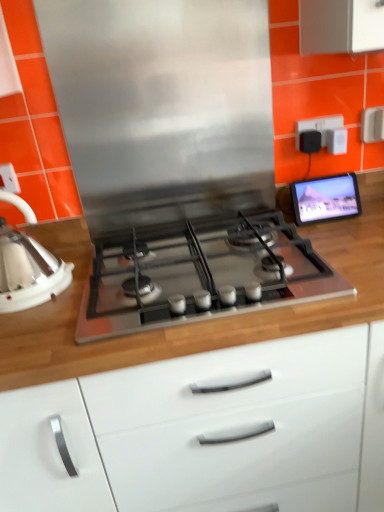
Question: Considering the positions of matte black tablet at upper right and wooden countertop at center in the image, is matte black tablet at upper right bigger or smaller than wooden countertop at center?

Choices:
 (A) small
 (B) big

Answer: (A)

Question: From a real-world perspective, is matte black tablet at upper right positioned above or below wooden countertop at center?

Choices:
 (A) above
 (B) below

Answer: (A)

Question: Estimate the real-world distances between objects in this image. Which object is farther from the black plastic outlet at upper right, the 2th electric outlet from the front?

Choices:
 (A) stainless steel gas stove at center
 (B) matte black tablet at upper right
 (C) stainless steel exhaust hood at center
 (D) wooden countertop at center
 (E) white glossy kettle at left

Answer: (E)

Question: Estimate the real-world distances between objects in this image. Which object is farther from the stainless steel exhaust hood at center?

Choices:
 (A) white plastic electric outlet at upper left, which appears as the second electric outlet when viewed from the top
 (B) wooden countertop at center
 (C) black plastic outlet at upper right, positioned as the 1th electric outlet in back-to-front order
 (D) matte black tablet at upper right
 (E) stainless steel gas stove at center

Answer: (A)